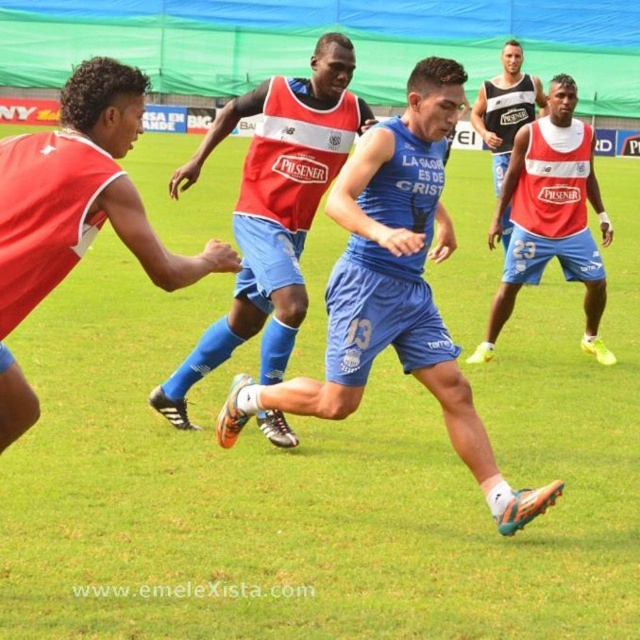
Between matte red jersey at center and matte black tank top at upper right, which one has less height?

With less height is matte black tank top at upper right.

You are a GUI agent. You are given a task and a screenshot of the screen. Output one action in this format:
    pyautogui.click(x=<x>, y=<y>)
    Task: Click on the matte red jersey at center
    The width and height of the screenshot is (640, 640).
    Given the screenshot: What is the action you would take?
    pyautogui.click(x=273, y=211)

Where is `matte red jersey at center`? This screenshot has width=640, height=640. matte red jersey at center is located at coordinates (273, 211).

Is matte red jersey at left smaller than matte black tank top at upper right?

Incorrect, matte red jersey at left is not smaller in size than matte black tank top at upper right.

Which is below, matte red jersey at left or matte black tank top at upper right?

matte red jersey at left is lower down.

Identify the location of matte red jersey at left. The width and height of the screenshot is (640, 640). (76, 212).

Is point (269, 284) positioned after point (172, 291)?

Yes.

Which of these two, matte red jersey at center or matte red jersey at left, stands shorter?

Standing shorter between the two is matte red jersey at left.

Is point (275, 332) positioned behind point (147, 236)?

Yes.

At what (x,y) coordinates should I click in order to perform the action: click on matte red jersey at center. Please return your answer as a coordinate pair (x, y). Looking at the image, I should click on (273, 211).